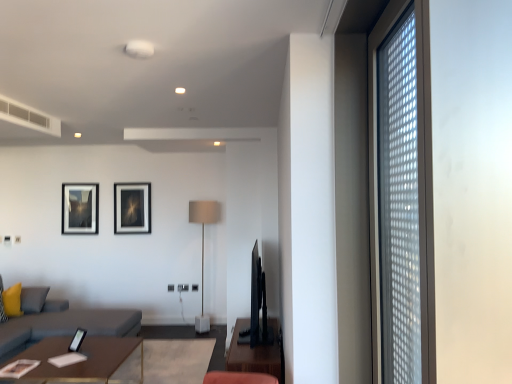
Where is `vacant space situated on the left part of matte black picture frame at lower center, which ranks as the third picture frame in back-to-front order`? vacant space situated on the left part of matte black picture frame at lower center, which ranks as the third picture frame in back-to-front order is located at coordinates (53, 346).